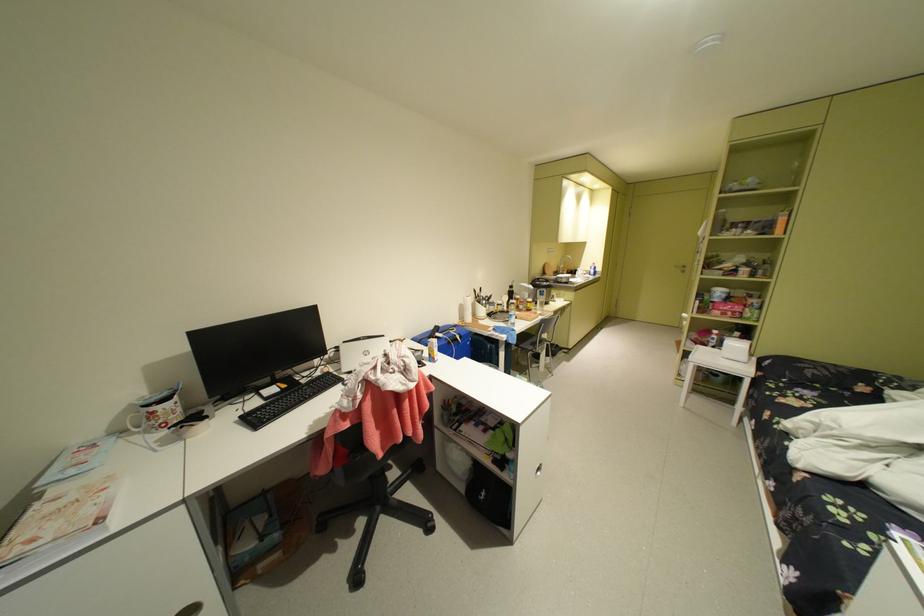
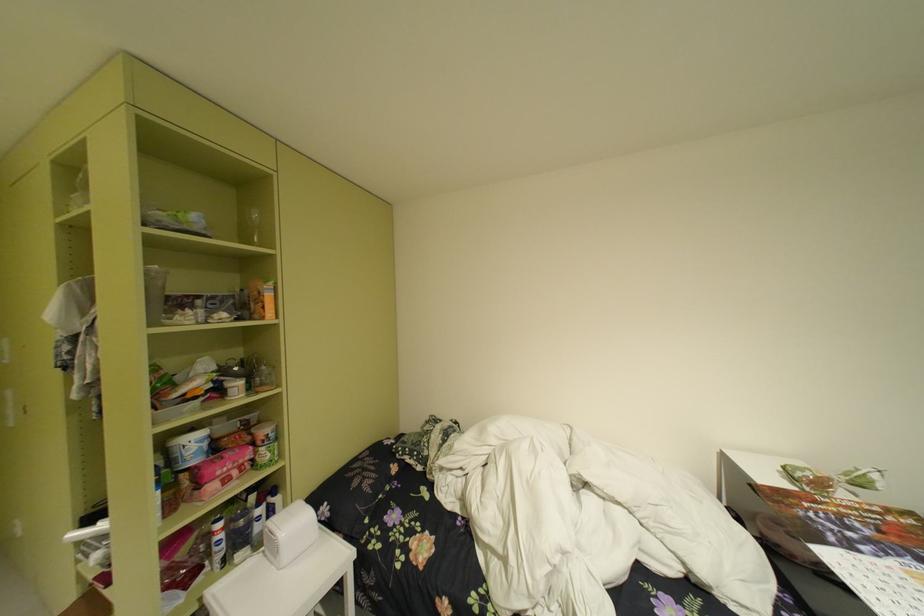
In the second image, find the point that corresponds to (x=727, y=334) in the first image.

(235, 528)